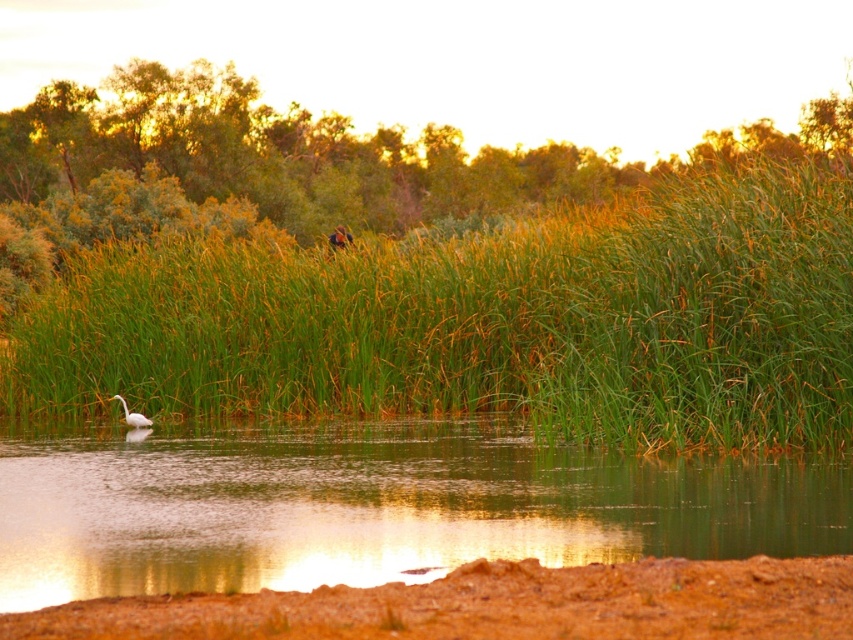
Consider the image. You are standing at the point marked as point (373, 506) in the scene. What can you observe around you?

At point (373, 506) lies clear water at center, so you are standing in clear water at center.

Consider the image. You are standing at the point with coordinates point (137, 419) and want to walk to the point with coordinates point (708, 369). Which direction should you move in to reach your destination?

You should move forward because point (708, 369) is in front of point (137, 419).

You are an observer standing at the edge of the water. You see the green grass at center and the white matte bird at lower left. Which object is closer to your right side?

The green grass at center is to the right of the white matte bird at lower left, so it is closer to your right side.